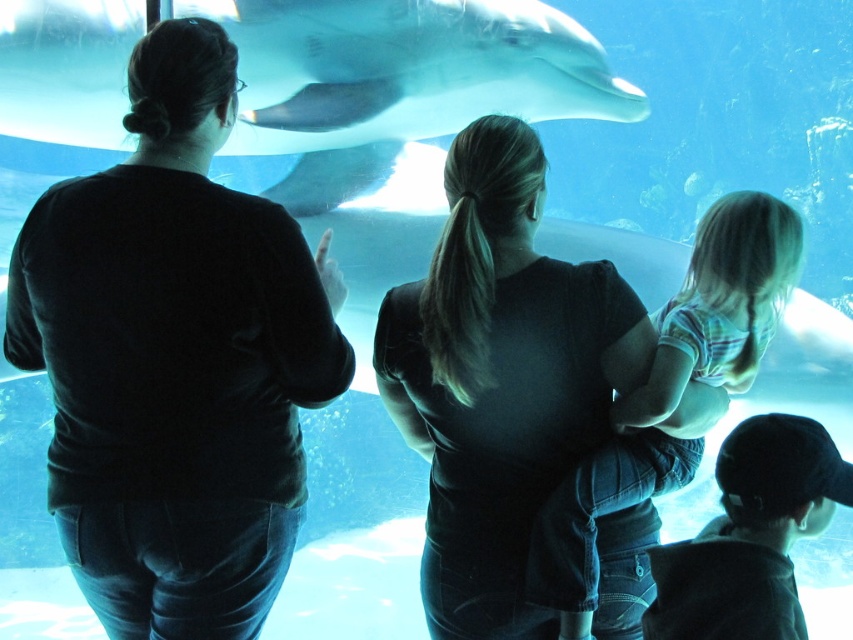
You are a tour guide standing at the entrance of the aquarium. You notice a visitor wearing a black matte shirt at center who is 3.21 meters away from you. You want to hand them a brochure. Can you reach them without moving from your current position if your maximum reaching distance is 3 meters?

The black matte shirt at center is 3.21 meters away from the viewer, which exceeds the tour guide maximum reaching distance of 3 meters. Therefore, the tour guide cannot reach them without moving.

You are a tour guide leading a group at the aquarium. You notice two visitors wearing a black matte shirt at center and a striped cotton shirt at center. Which visitor is standing to the left of the other?

The black matte shirt at center is positioned on the left side of striped cotton shirt at center, so the visitor wearing the black matte shirt at center is standing to the left of the one in the striped cotton shirt at center.